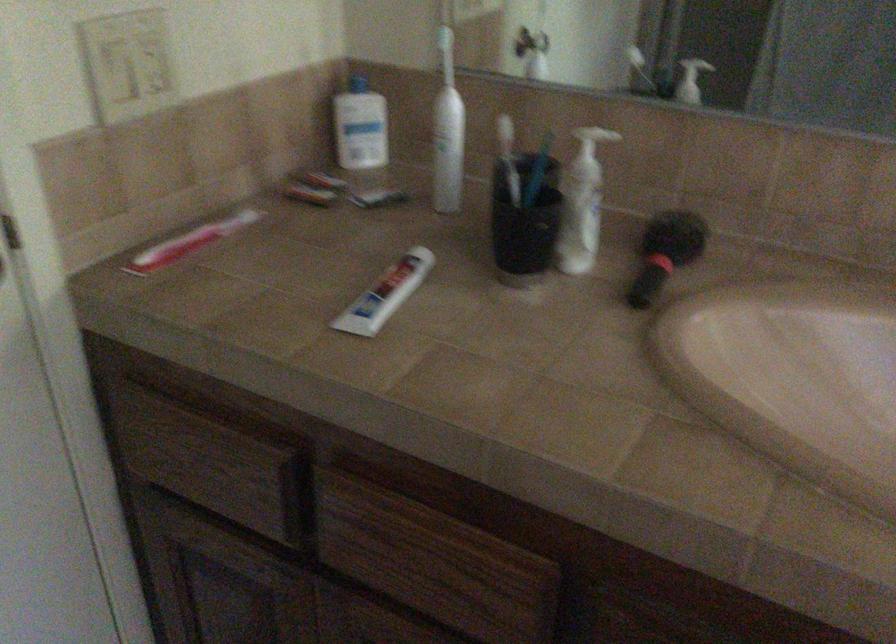
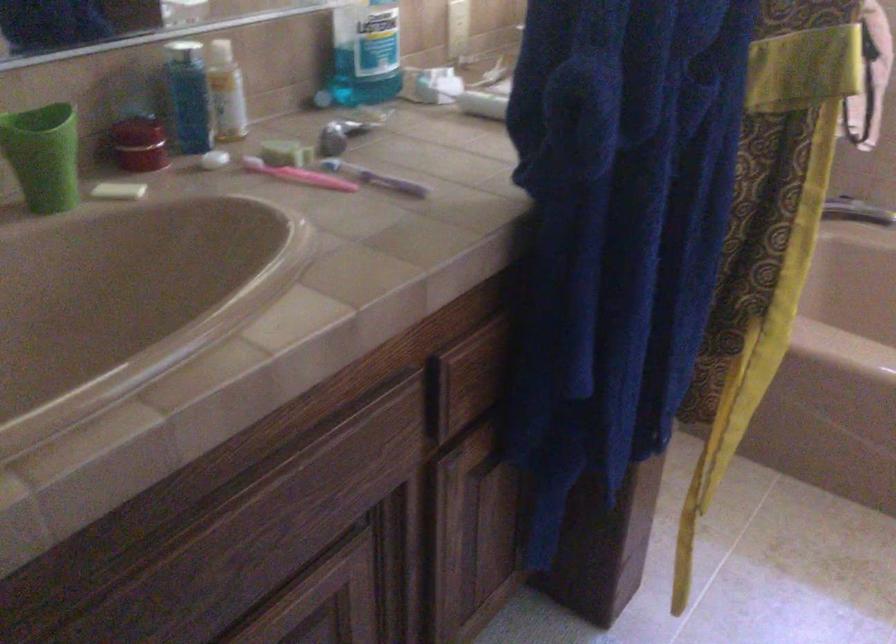
The first image is from the beginning of the video and the second image is from the end. How did the camera likely rotate when shooting the video?

The rotation direction of the camera is right-down.